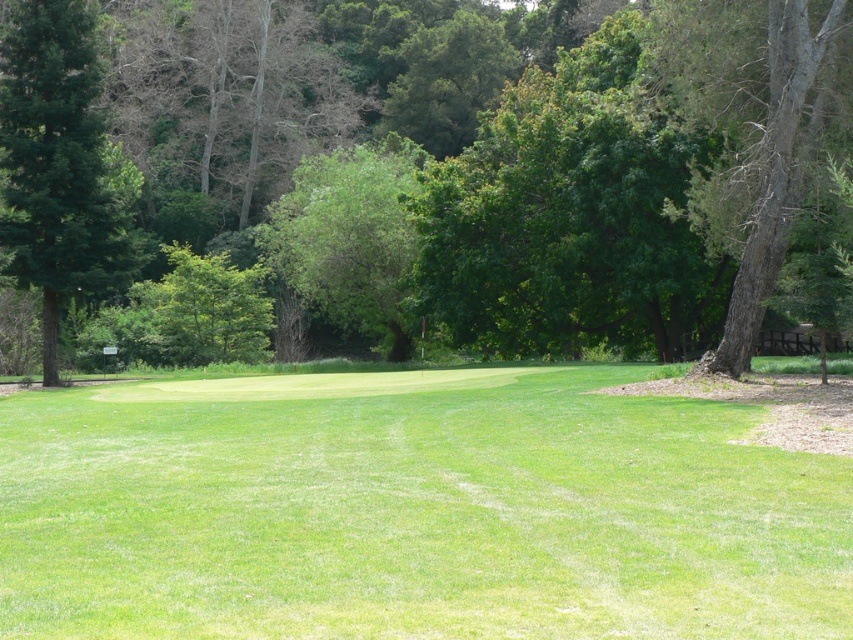
Who is higher up, green smooth grass at center or green matte tree at left?

green matte tree at left

What do you see at coordinates (412, 512) in the screenshot? I see `green smooth grass at center` at bounding box center [412, 512].

The width and height of the screenshot is (853, 640). In order to click on green smooth grass at center in this screenshot , I will do `click(412, 512)`.

Is green smooth grass at center bigger than green leafy tree at center?

No.

Is point (370, 580) farther from viewer compared to point (264, 253)?

That is False.

I want to click on green smooth grass at center, so point(412,512).

How far apart are green leafy tree at center and smooth gray bark tree at right?

green leafy tree at center and smooth gray bark tree at right are 38.18 meters apart.

Is green leafy tree at center above smooth gray bark tree at right?

Indeed, green leafy tree at center is positioned over smooth gray bark tree at right.

Which is behind, point (717, 182) or point (759, 292)?

The point (717, 182) is behind.

Find the location of `green leafy tree at center`. green leafy tree at center is located at coordinates (589, 188).